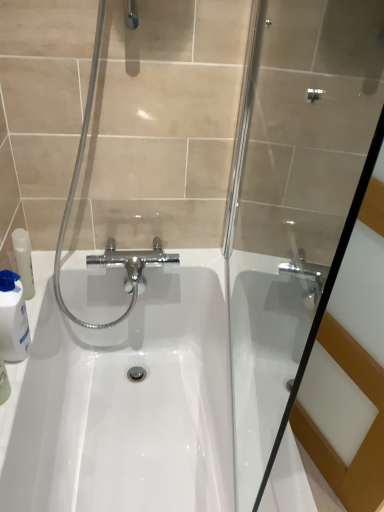
Question: From the image's perspective, is white glossy sink at center above white glossy bottle at left?

Choices:
 (A) no
 (B) yes

Answer: (A)

Question: Does white glossy sink at center turn towards white glossy bottle at left?

Choices:
 (A) no
 (B) yes

Answer: (A)

Question: Is white glossy sink at center oriented away from white glossy bottle at left?

Choices:
 (A) no
 (B) yes

Answer: (A)

Question: Is white glossy sink at center not near white glossy bottle at left?

Choices:
 (A) yes
 (B) no

Answer: (B)

Question: Does white glossy sink at center have a greater width compared to white glossy bottle at left?

Choices:
 (A) yes
 (B) no

Answer: (A)

Question: In terms of height, does transparent glass shower door at center look taller or shorter compared to white glossy sink at center?

Choices:
 (A) tall
 (B) short

Answer: (A)

Question: Is transparent glass shower door at center in front of or behind white glossy sink at center in the image?

Choices:
 (A) behind
 (B) front

Answer: (B)

Question: Which is correct: transparent glass shower door at center is inside white glossy sink at center, or outside of it?

Choices:
 (A) inside
 (B) outside

Answer: (B)

Question: From a real-world perspective, is transparent glass shower door at center positioned above or below white glossy sink at center?

Choices:
 (A) below
 (B) above

Answer: (B)

Question: From a real-world perspective, is white glossy bottle at left positioned above or below transparent glass shower door at center?

Choices:
 (A) above
 (B) below

Answer: (B)

Question: Does point (19, 333) appear closer or farther from the camera than point (311, 338)?

Choices:
 (A) farther
 (B) closer

Answer: (B)

Question: From their relative heights in the image, would you say white glossy bottle at left is taller or shorter than transparent glass shower door at center?

Choices:
 (A) short
 (B) tall

Answer: (A)

Question: In the image, is white glossy bottle at left positioned in front of or behind transparent glass shower door at center?

Choices:
 (A) front
 (B) behind

Answer: (B)

Question: From a real-world perspective, relative to white glossy bottle at left, is transparent glass shower door at center vertically above or below?

Choices:
 (A) above
 (B) below

Answer: (A)

Question: Is transparent glass shower door at center wider or thinner than white glossy bottle at left?

Choices:
 (A) thin
 (B) wide

Answer: (A)